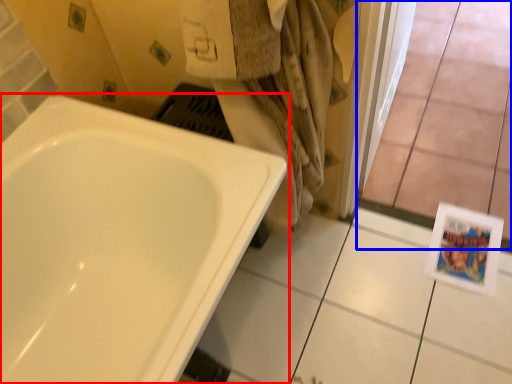
Question: Which object is further to the camera taking this photo, bathtub (highlighted by a red box) or glass door (highlighted by a blue box)?

Choices:
 (A) bathtub
 (B) glass door

Answer: (B)